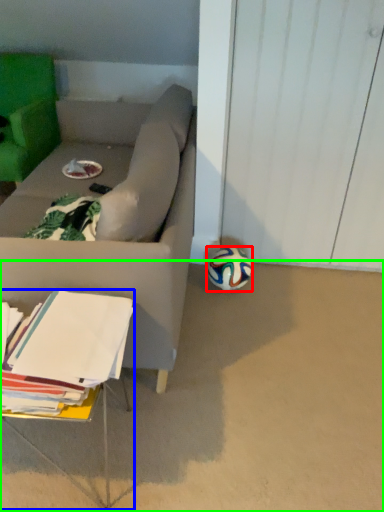
Question: Estimate the real-world distances between objects in this image. Which object is farther from ball (highlighted by a red box), table (highlighted by a blue box) or concrete (highlighted by a green box)?

Choices:
 (A) table
 (B) concrete

Answer: (A)